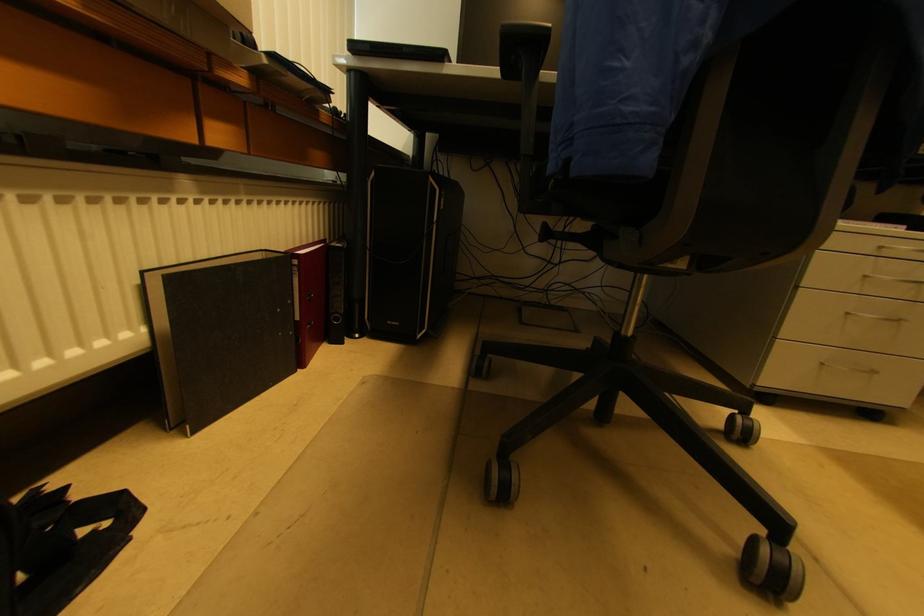
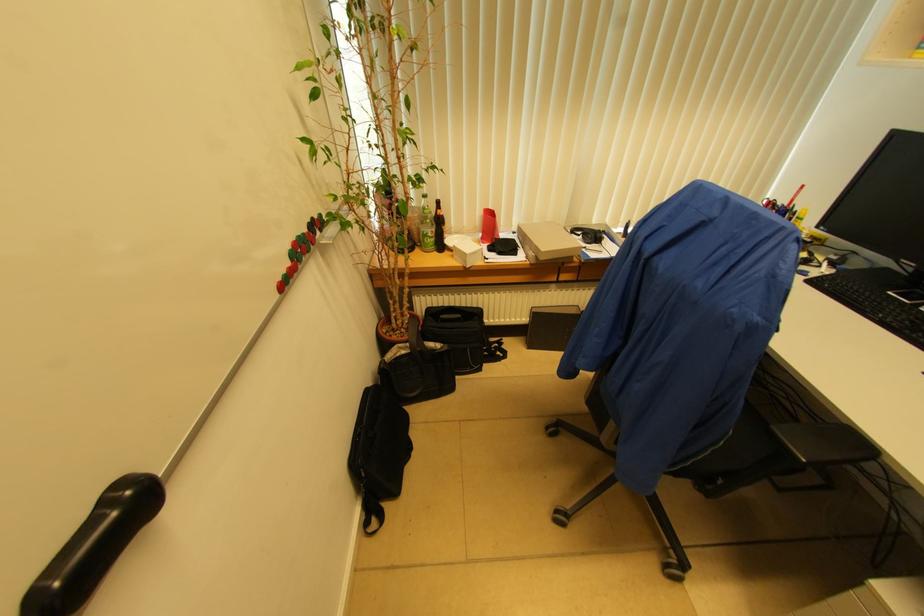
The point at [107,525] is marked in the first image. Where is the corresponding point in the second image?

(503, 358)